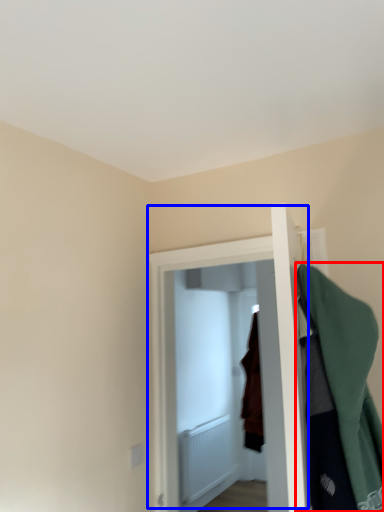
Question: Among these objects, which one is nearest to the camera, cloak (highlighted by a red box) or door (highlighted by a blue box)?

Choices:
 (A) cloak
 (B) door

Answer: (A)